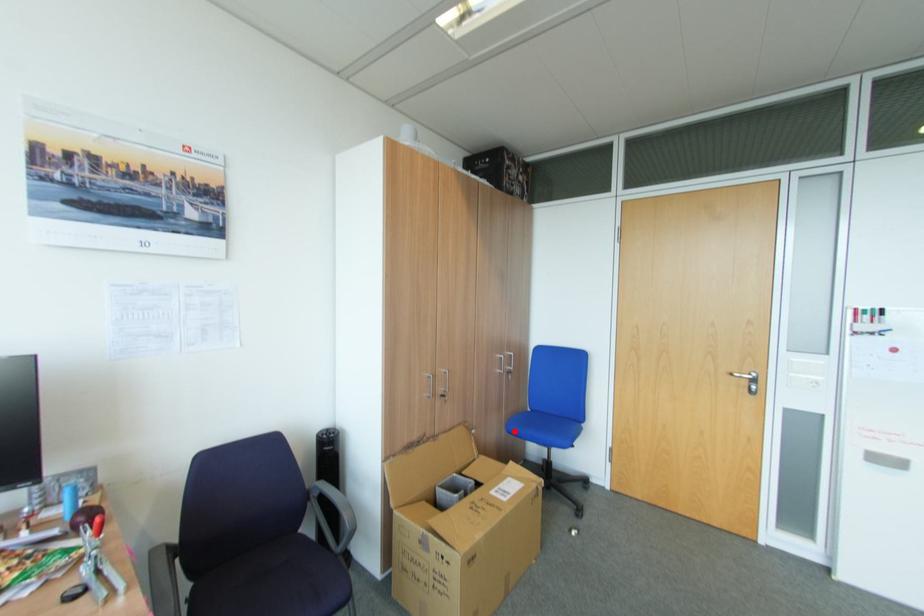
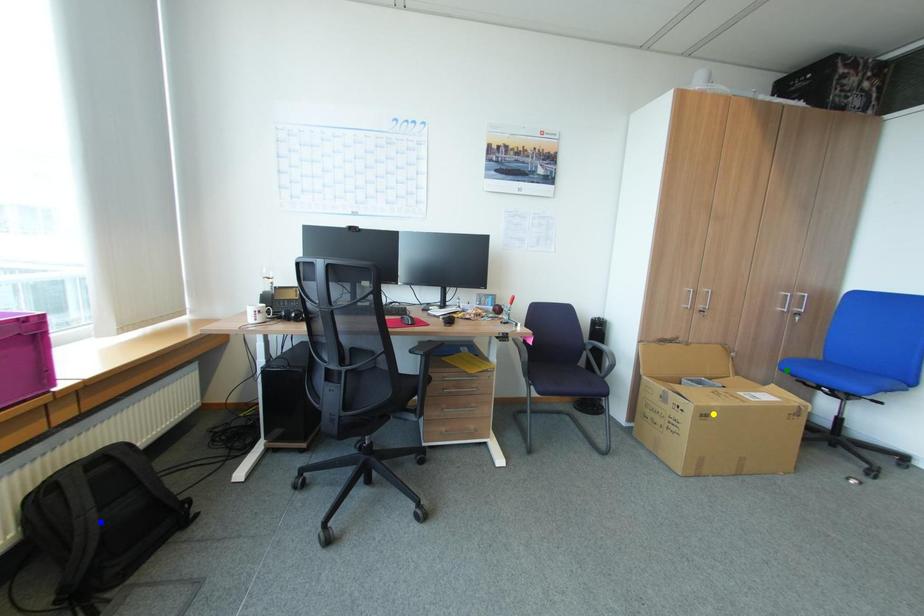
Question: I am providing you with two images of the same scene from different viewpoints. A red point is marked on the first image. You are given multiple points on the second image. Which spot in image 2 lines up with the point in image 1?

Choices:
 (A) blue point
 (B) yellow point
 (C) green point

Answer: (C)